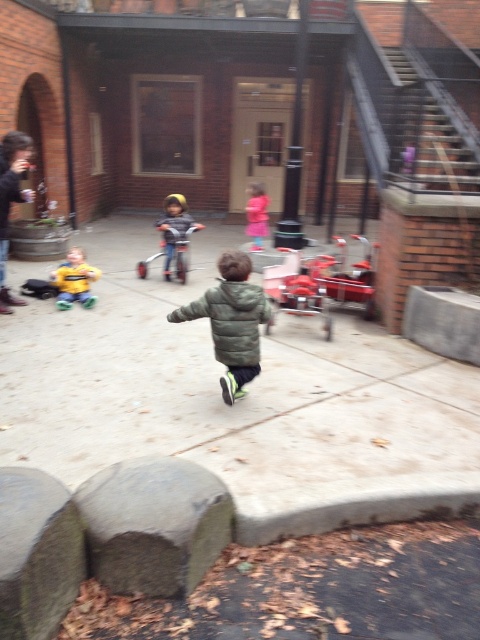
You are a parent trying to get your child to the metallic silver tricycle at center. Your child is currently standing on the gray concrete pavement at center. Which direction should they move to reach the tricycle?

The gray concrete pavement at center is positioned on the left side of the metallic silver tricycle at center, so the child should move to the right to reach the tricycle.

You are a parent trying to get your child to the metallic silver tricycle at center. The child is currently standing on the gray concrete pavement at center. Which direction should you guide the child to move in order to reach the tricycle?

The gray concrete pavement at center is closer to the viewer than the metallic silver tricycle at center, so you should guide the child to move forward towards the tricycle.

You are a parent trying to decide whether to let your child ride the metallic silver tricycle at center while wearing the matte blue helmet at center. Based on their sizes, will the helmet fit properly?

The matte blue helmet at center is not as tall as the metallic silver tricycle at center, which means the helmet is shorter in height compared to the tricycle. However, helmet fit depends on head size, not tricycle size. The description does not provide information about the helmet being too small or large for the child, so the parent should ensure the helmet fits the child properly by checking its size and securement features.